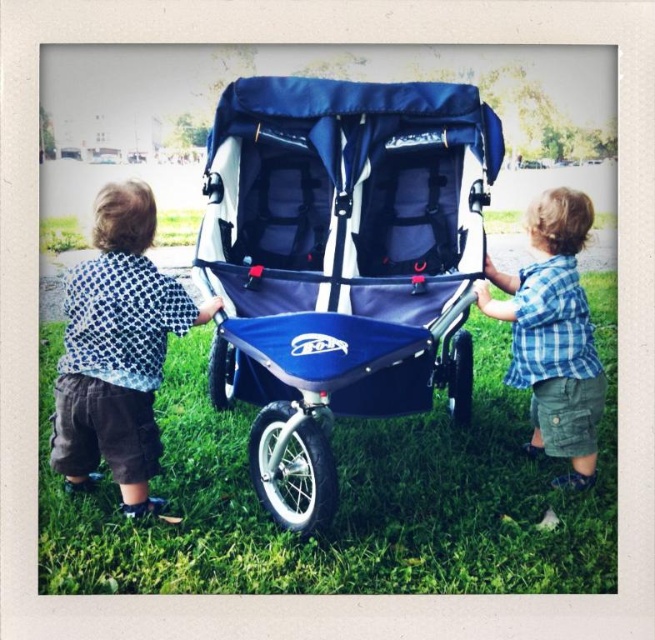
You are a photographer trying to capture a photo of the blue fabric stroller at center and the polka dot shirt at left. Based on their positions, which object should you focus on first to ensure both are in frame?

The blue fabric stroller at center is above the polka dot shirt at left, so you should focus on the polka dot shirt at left first to ensure both are in frame.

You are a photographer trying to capture both children in the frame. Since the polka dot shirt at left and the blue plaid shirt at center are in the scene, which child should you focus on to ensure they take up more space in the photo?

The blue plaid shirt at center occupies more space than the polka dot shirt at left, so focusing on the blue plaid shirt at center would ensure the child takes up more space in the photo.